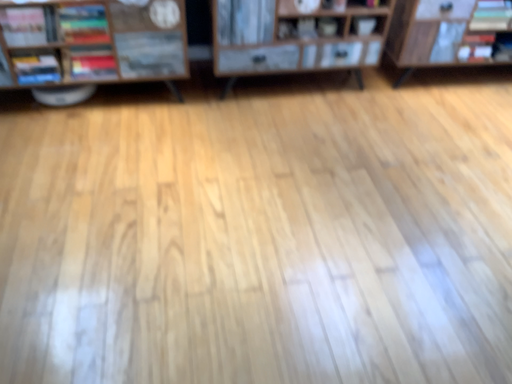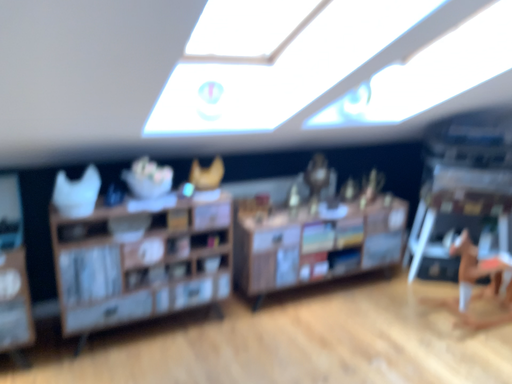
Question: Which way did the camera rotate in the video?

Choices:
 (A) rotated left
 (B) rotated right

Answer: (B)